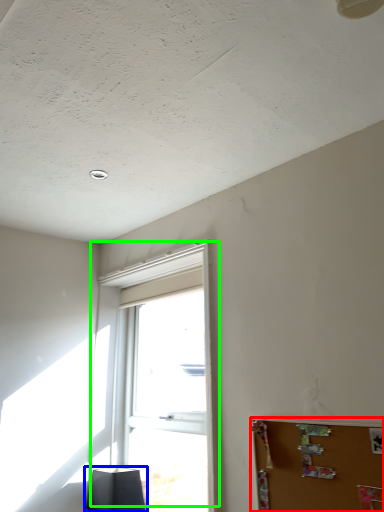
Question: Which object is the farthest from bulletin board (highlighted by a red box)? Choose among these: lamp (highlighted by a blue box) or window (highlighted by a green box).

Choices:
 (A) lamp
 (B) window

Answer: (A)